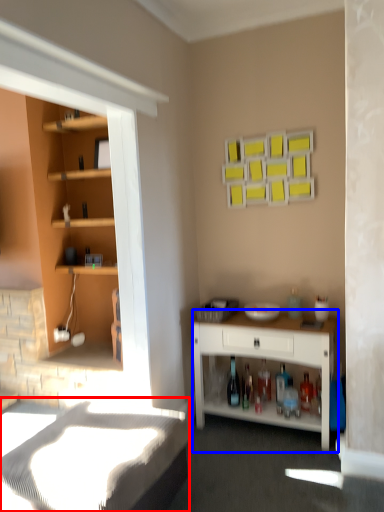
Question: Which point is further to the camera, bed frame (highlighted by a red box) or desk (highlighted by a blue box)?

Choices:
 (A) bed frame
 (B) desk

Answer: (B)